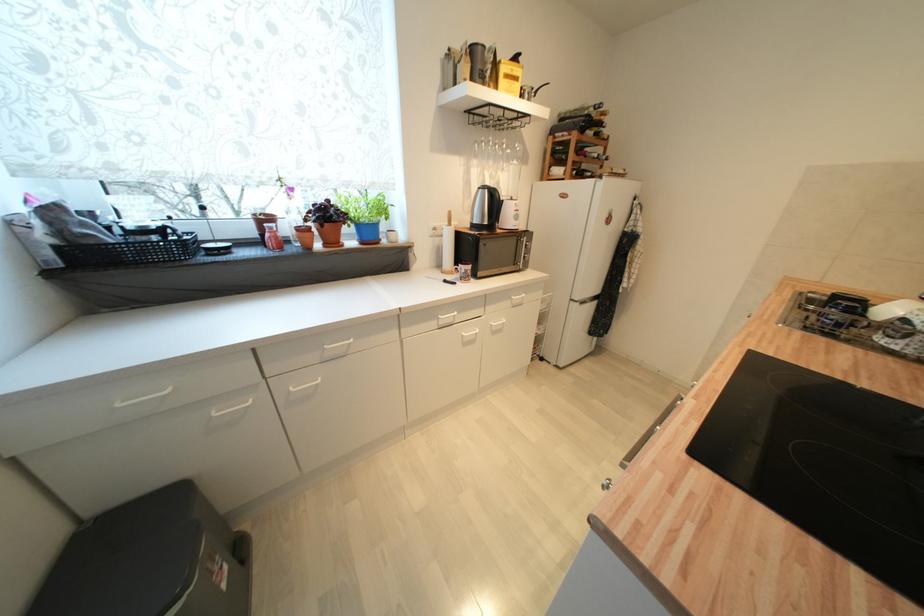
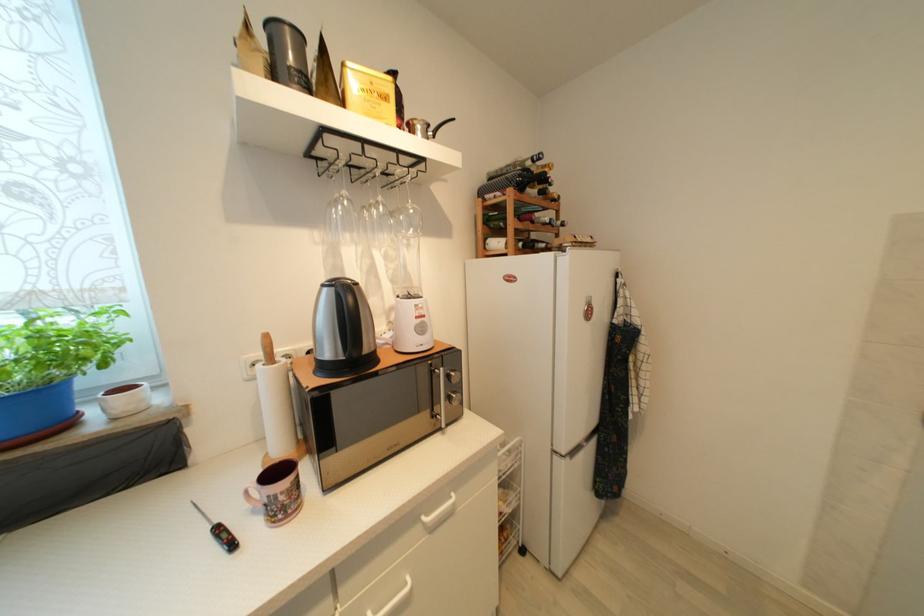
In the second image, find the point that corresponds to the point at 475,269 in the first image.

(289, 485)